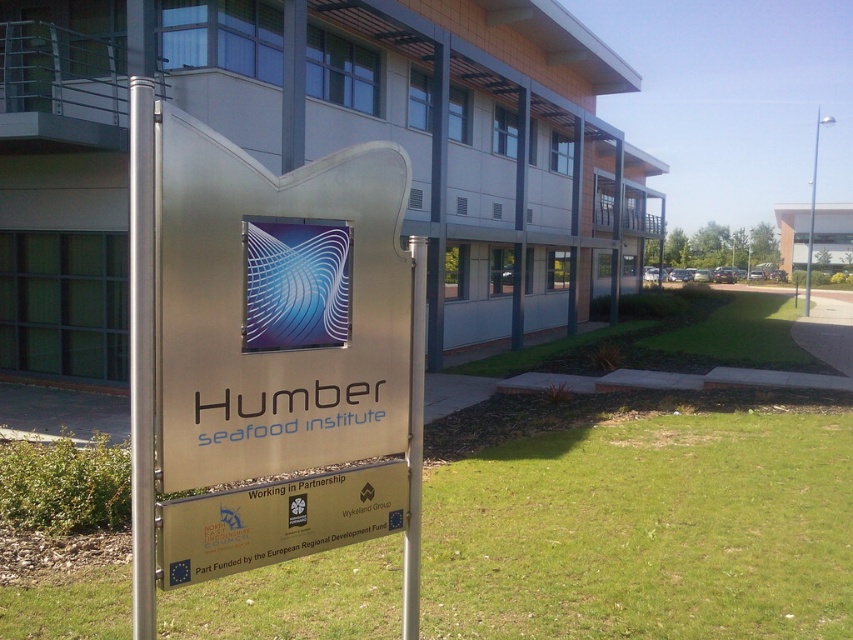
You are a visitor approaching the Humber Seafood Institute and notice the green grass at lower center and the silver metallic pole at upper right. Which object is taller? Please answer based on the description provided.

The silver metallic pole at upper right is taller than the green grass at lower center.